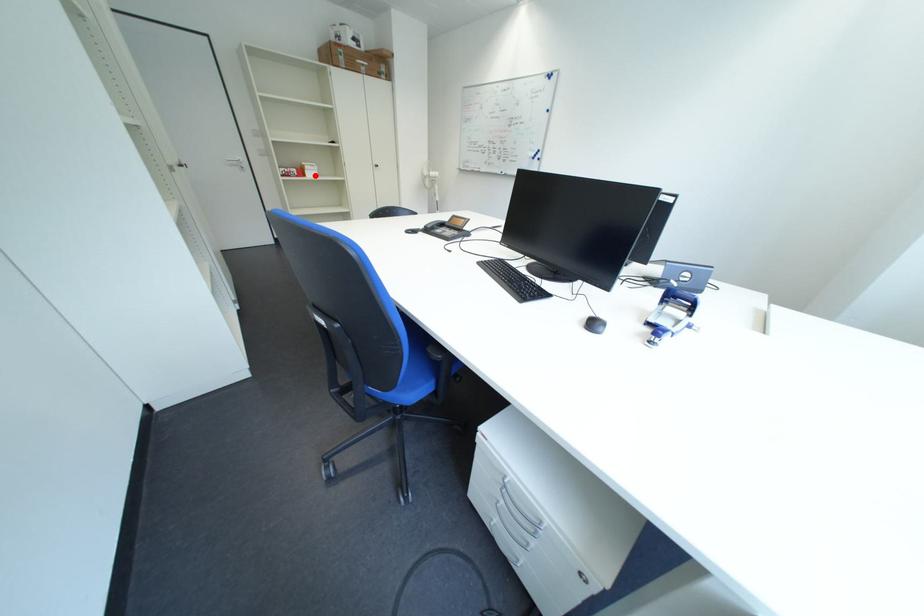
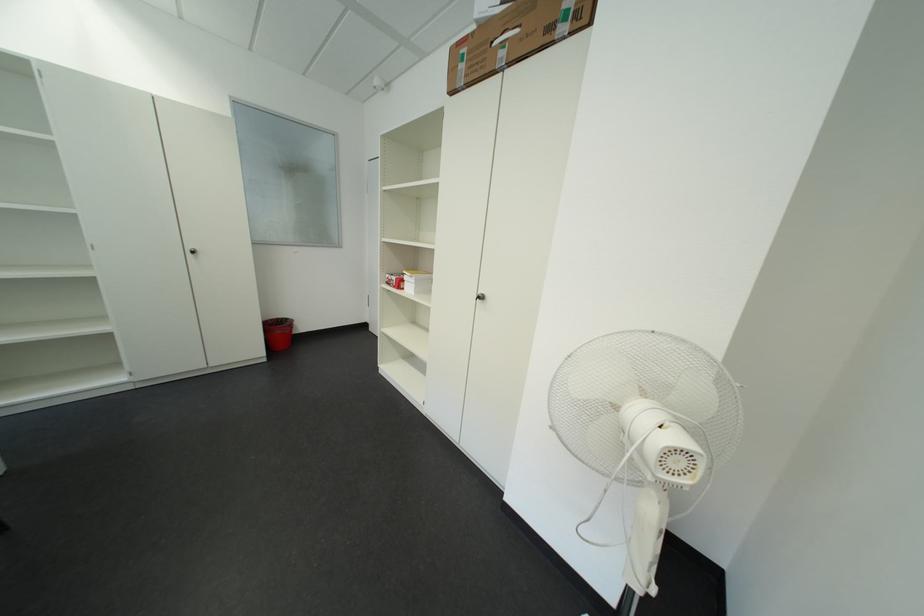
Question: I am providing you with two images of the same scene from different viewpoints. Image1 has a red point marked. In image2, the corresponding 3D location appears at what relative position? Reply with the corresponding letter.

Choices:
 (A) Closer
 (B) Farther

Answer: (B)